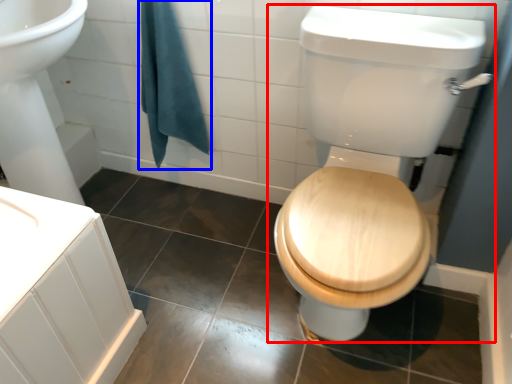
Question: Which object appears closest to the camera in this image, toilet (highlighted by a red box) or bath towel (highlighted by a blue box)?

Choices:
 (A) toilet
 (B) bath towel

Answer: (A)